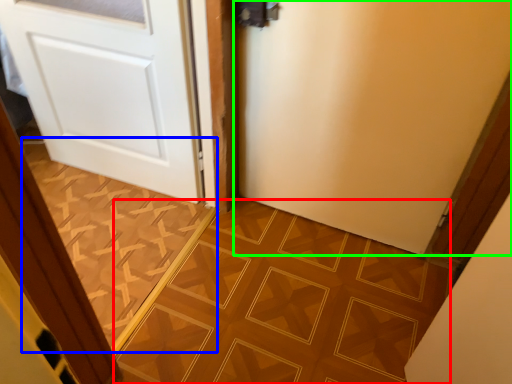
Question: Estimate the real-world distances between objects in this image. Which object is farther from ceramic tile (highlighted by a red box), ceramic tile (highlighted by a blue box) or door (highlighted by a green box)?

Choices:
 (A) ceramic tile
 (B) door

Answer: (B)